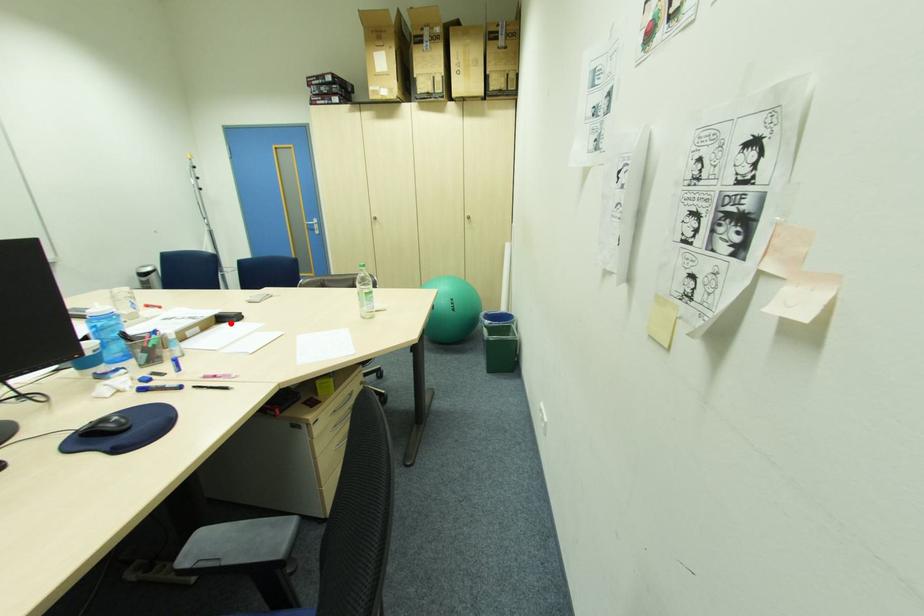
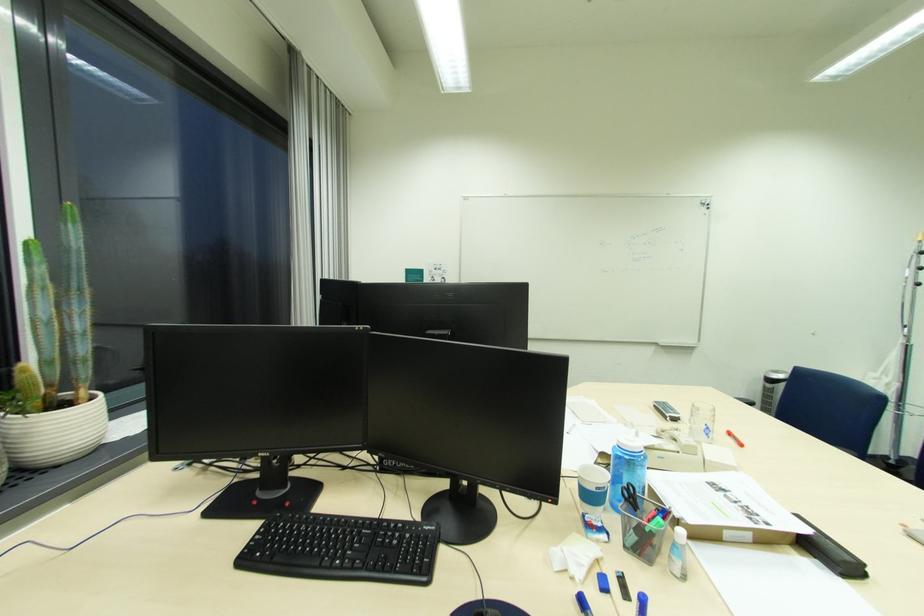
The point at the highlighted location is marked in the first image. Where is the corresponding point in the second image?

(821, 557)